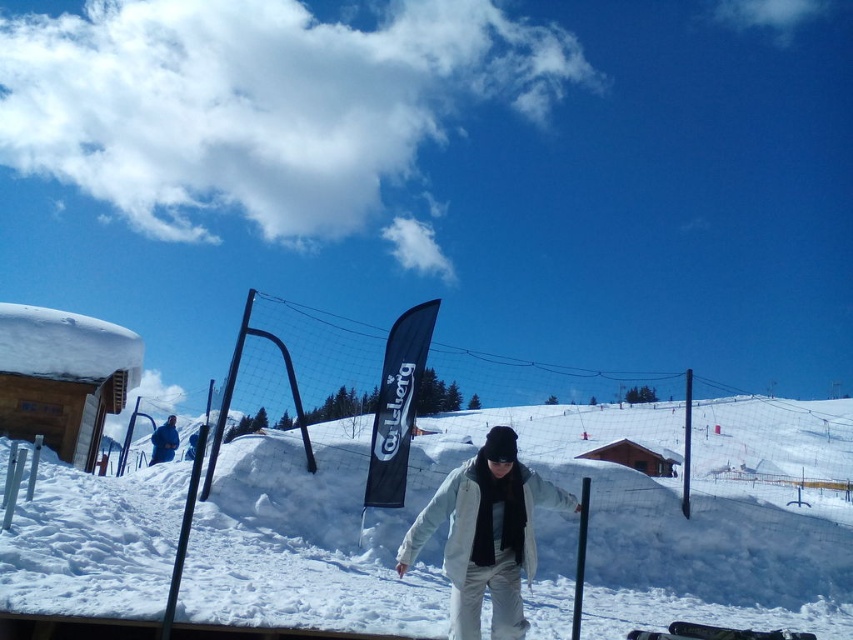
Question: Among these points, which one is nearest to the camera?

Choices:
 (A) (808, 536)
 (B) (173, 448)

Answer: (A)

Question: Does white fluffy snow at center have a smaller size compared to blue fabric jacket at lower left?

Choices:
 (A) yes
 (B) no

Answer: (B)

Question: Is white fluffy snow at center closer to the viewer compared to blue fabric jacket at lower left?

Choices:
 (A) no
 (B) yes

Answer: (B)

Question: Considering the relative positions of white fluffy snow at center and blue fabric jacket at lower left in the image provided, where is white fluffy snow at center located with respect to blue fabric jacket at lower left?

Choices:
 (A) right
 (B) left

Answer: (A)

Question: Among these objects, which one is farthest from the camera?

Choices:
 (A) blue fabric jacket at lower left
 (B) white fluffy snow at center

Answer: (A)